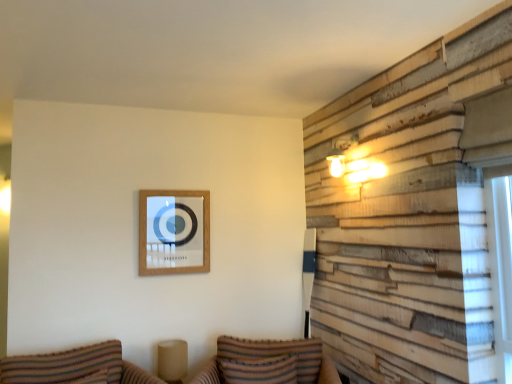
Question: Considering the relative positions of striped fabric couch at lower left, acting as the first couch starting from the left, and striped fabric couch at lower center, which is the first couch in right-to-left order, in the image provided, is striped fabric couch at lower left, acting as the first couch starting from the left, to the left or to the right of striped fabric couch at lower center, which is the first couch in right-to-left order,?

Choices:
 (A) left
 (B) right

Answer: (A)

Question: Considering the positions of striped fabric couch at lower left, which is counted as the 2th couch, starting from the right, and striped fabric couch at lower center, which is the first couch in right-to-left order, in the image, is striped fabric couch at lower left, which is counted as the 2th couch, starting from the right, taller or shorter than striped fabric couch at lower center, which is the first couch in right-to-left order,?

Choices:
 (A) short
 (B) tall

Answer: (A)

Question: Estimate the real-world distances between objects in this image. Which object is closer to the striped fabric couch at lower center, the 2th couch when ordered from left to right?

Choices:
 (A) striped fabric couch at lower left, acting as the first couch starting from the left
 (B) wooden picture frame at upper center
 (C) striped fabric pillow at lower center

Answer: (C)

Question: Estimate the real-world distances between objects in this image. Which object is farther from the striped fabric couch at lower center, which is the first couch in right-to-left order?

Choices:
 (A) striped fabric pillow at lower center
 (B) wooden picture frame at upper center
 (C) striped fabric couch at lower left, acting as the first couch starting from the left

Answer: (B)